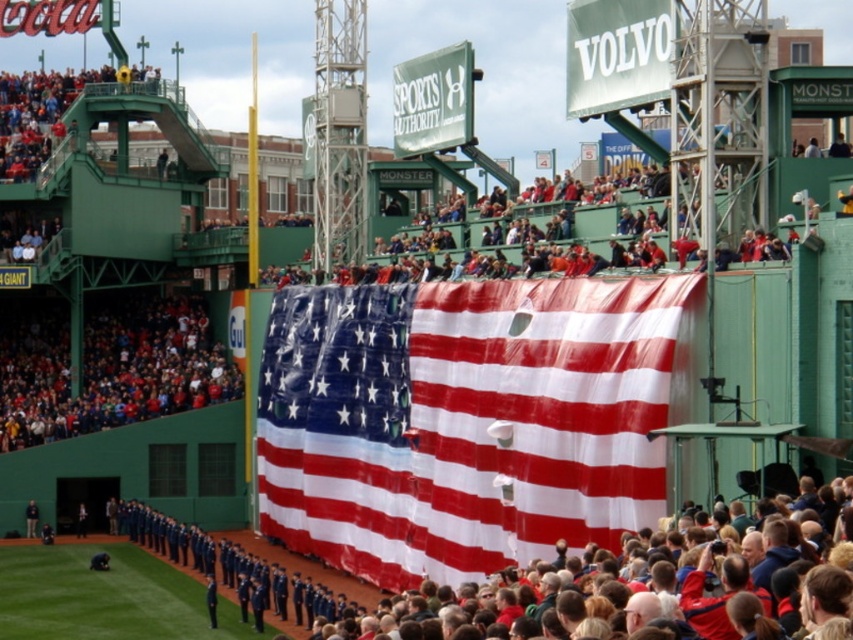
Who is taller, polyester american flag at center or dark blue uniform at lower left?

polyester american flag at center is taller.

Who is lower down, polyester american flag at center or dark blue uniform at lower left?

Positioned lower is dark blue uniform at lower left.

Where is `polyester american flag at center`? polyester american flag at center is located at coordinates (465, 419).